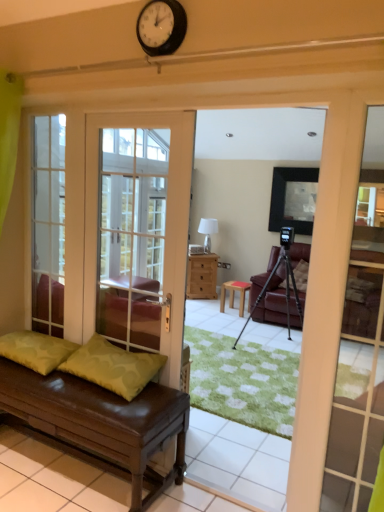
Question: Does matte black frame at upper center contain white face clock at upper center?

Choices:
 (A) yes
 (B) no

Answer: (B)

Question: Is matte black frame at upper center wider than white face clock at upper center?

Choices:
 (A) yes
 (B) no

Answer: (A)

Question: From a real-world perspective, is matte black frame at upper center below white face clock at upper center?

Choices:
 (A) yes
 (B) no

Answer: (A)

Question: Could you tell me if matte black frame at upper center is facing white face clock at upper center?

Choices:
 (A) yes
 (B) no

Answer: (A)

Question: Is matte black frame at upper center thinner than white face clock at upper center?

Choices:
 (A) yes
 (B) no

Answer: (B)

Question: Does point (200, 227) appear closer or farther from the camera than point (21, 394)?

Choices:
 (A) farther
 (B) closer

Answer: (A)

Question: In terms of size, does white glossy lampshade at center appear bigger or smaller than brown leather bench at lower left?

Choices:
 (A) small
 (B) big

Answer: (A)

Question: In the image, is white glossy lampshade at center on the left side or the right side of brown leather bench at lower left?

Choices:
 (A) right
 (B) left

Answer: (A)

Question: From the image's perspective, is white glossy lampshade at center positioned above or below brown leather bench at lower left?

Choices:
 (A) below
 (B) above

Answer: (B)

Question: Is clear glass door at left taller or shorter than white glass door at left?

Choices:
 (A) short
 (B) tall

Answer: (A)

Question: From a real-world perspective, is clear glass door at left above or below white glass door at left?

Choices:
 (A) above
 (B) below

Answer: (A)

Question: Looking at the image, does clear glass door at left seem bigger or smaller compared to white glass door at left?

Choices:
 (A) small
 (B) big

Answer: (A)

Question: Is point (54, 321) positioned closer to the camera than point (180, 234)?

Choices:
 (A) closer
 (B) farther

Answer: (B)

Question: From the image's perspective, is clear glass door at left above or below white face clock at upper center?

Choices:
 (A) below
 (B) above

Answer: (A)

Question: In terms of width, does clear glass door at left look wider or thinner when compared to white face clock at upper center?

Choices:
 (A) thin
 (B) wide

Answer: (B)